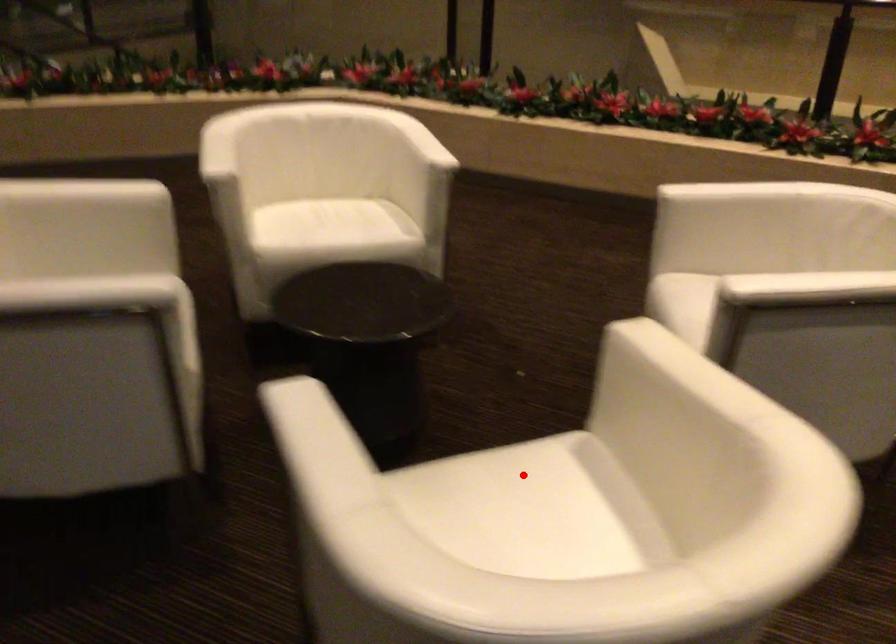
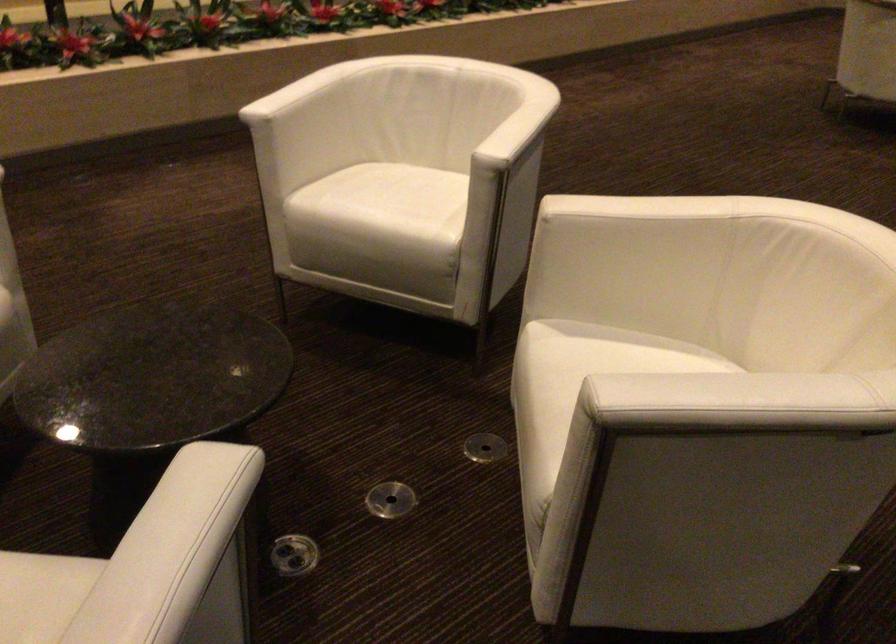
Locate, in the second image, the point that corresponds to the highlighted location in the first image.

(581, 366)